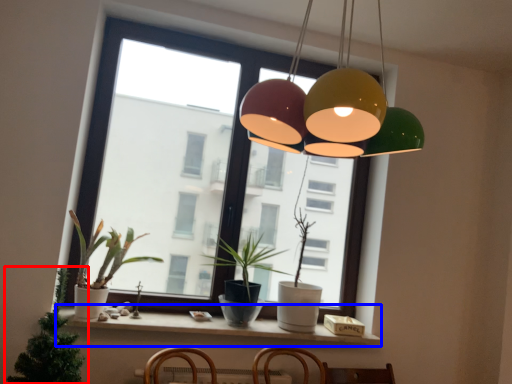
Question: Which object is further to the camera taking this photo, houseplant (highlighted by a red box) or window sill (highlighted by a blue box)?

Choices:
 (A) houseplant
 (B) window sill

Answer: (B)